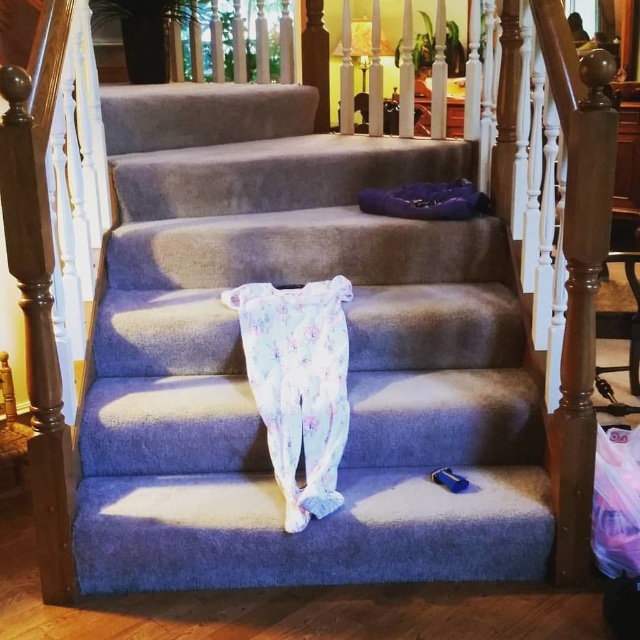
You are standing at the bottom of the staircase and want to pick up an item. There are two points marked on the image where items are located. Which point is closer to you, point (x=280, y=392) or point (x=364, y=211)?

Point (x=280, y=392) is closer to the viewer than point (x=364, y=211).

You are moving a fluffy cotton leggings at center and a purple soft pillow at upper center up the staircase. Which item will require more horizontal space when placed on the step?

The purple soft pillow at upper center requires more horizontal space because its width is greater than the fluffy cotton leggings at center.

Please use the coordinates provided to determine which object is located at the specified point in the image. The available objects are blue carpet at center and light pajama pants on third step from bottom. Which one is at point (348,358)?

The point (348,358) marks the blue carpet at center according to the description.